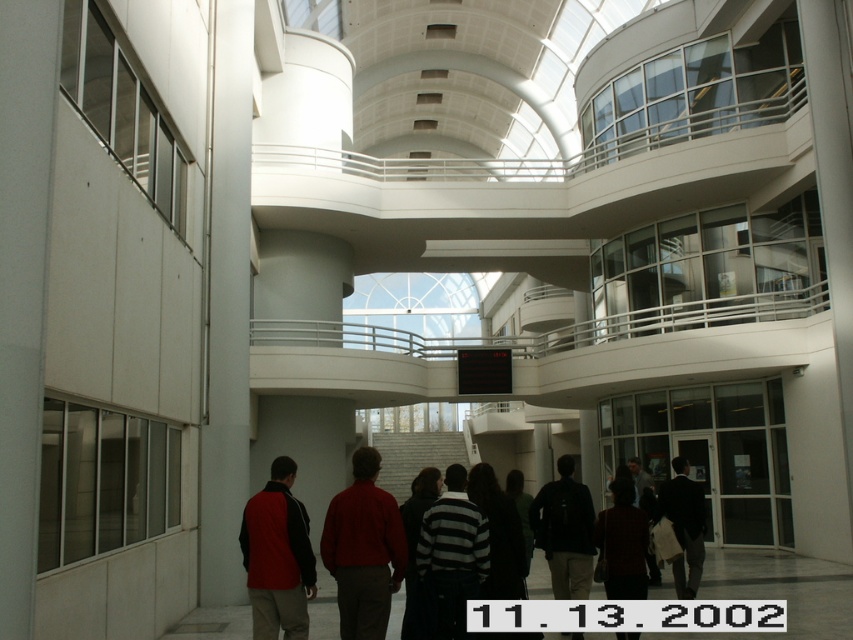
Question: Does red matte jacket at center have a lesser width compared to dark red sweater at center?

Choices:
 (A) no
 (B) yes

Answer: (B)

Question: Is striped sweater at center further to camera compared to dark brown backpack at center?

Choices:
 (A) no
 (B) yes

Answer: (A)

Question: Which point is farther from the camera taking this photo?

Choices:
 (A) (698, 576)
 (B) (291, 598)

Answer: (A)

Question: Which object is positioned closest to the red matte jacket at center?

Choices:
 (A) dark brown backpack at center
 (B) matte red jacket at center
 (C) dark red sweater at center

Answer: (B)

Question: Estimate the real-world distances between objects in this image. Which object is closer to the matte red jacket at center?

Choices:
 (A) striped sweater at center
 (B) dark brown leather jacket at center

Answer: (A)

Question: Is striped sweater at center above dark brown backpack at center?

Choices:
 (A) no
 (B) yes

Answer: (B)